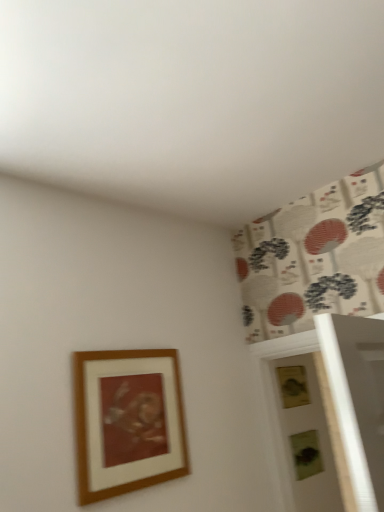
Locate an element on the screen. The width and height of the screenshot is (384, 512). wooden framed artwork at upper left is located at coordinates (127, 421).

Image resolution: width=384 pixels, height=512 pixels. Describe the element at coordinates (127, 421) in the screenshot. I see `wooden framed artwork at upper left` at that location.

Identify the location of wooden framed artwork at upper left. (127, 421).